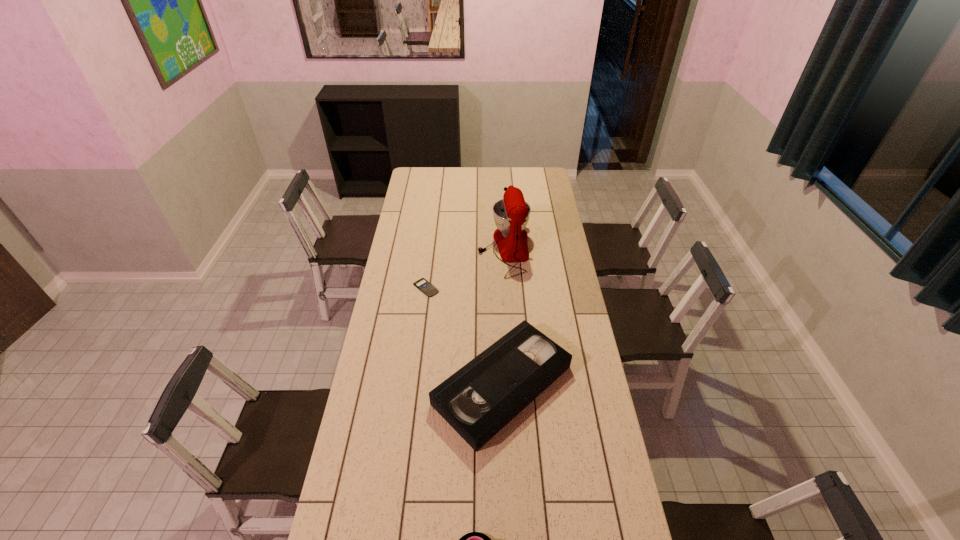
The height and width of the screenshot is (540, 960). I want to click on object present at the right edge, so click(482, 397).

Locate an element on the screen. vacant space at the far edge is located at coordinates (473, 169).

Locate an element on the screen. The height and width of the screenshot is (540, 960). free space at the left edge of the desktop is located at coordinates (432, 190).

In the image, there is a desktop. Identify the location of free space at the right edge. (548, 244).

At what (x,y) coordinates should I click in order to perform the action: click on vacant position at the far right corner of the desktop. Please return your answer as a coordinate pair (x, y). Looking at the image, I should click on (548, 177).

Identify the location of vacant point located between the mixer and the videotape. This screenshot has height=540, width=960. (503, 317).

Locate an element on the screen. vacant space that is in between the leftmost object and the second nearest object is located at coordinates (465, 336).

Identify the location of unoccupied area between the shortest object and the tallest object. (465, 268).

At what (x,y) coordinates should I click in order to perform the action: click on free spot between the calculator and the videotape. Please return your answer as a coordinate pair (x, y). Image resolution: width=960 pixels, height=540 pixels. Looking at the image, I should click on (465, 336).

Find the location of `object that is the nearest to the mixer`. object that is the nearest to the mixer is located at coordinates pyautogui.click(x=423, y=285).